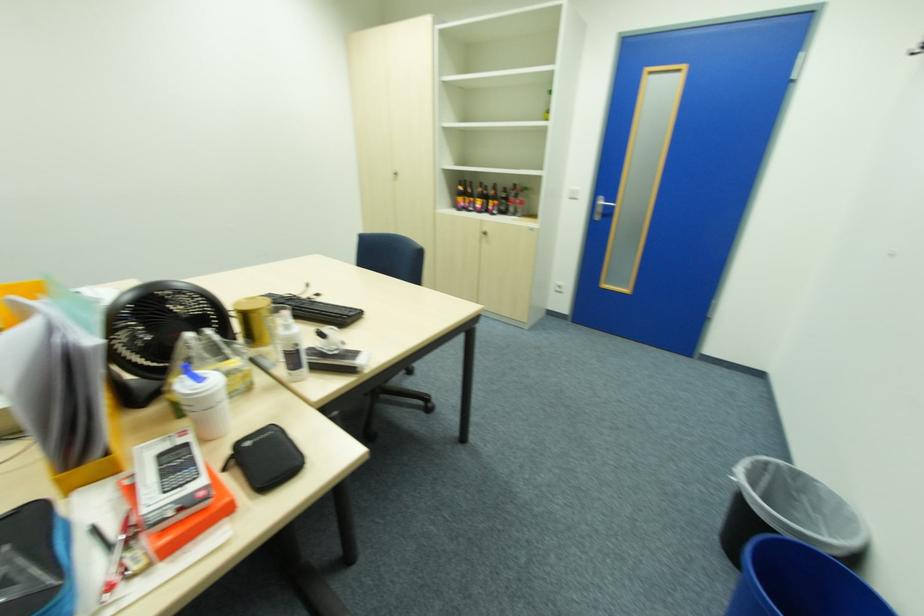
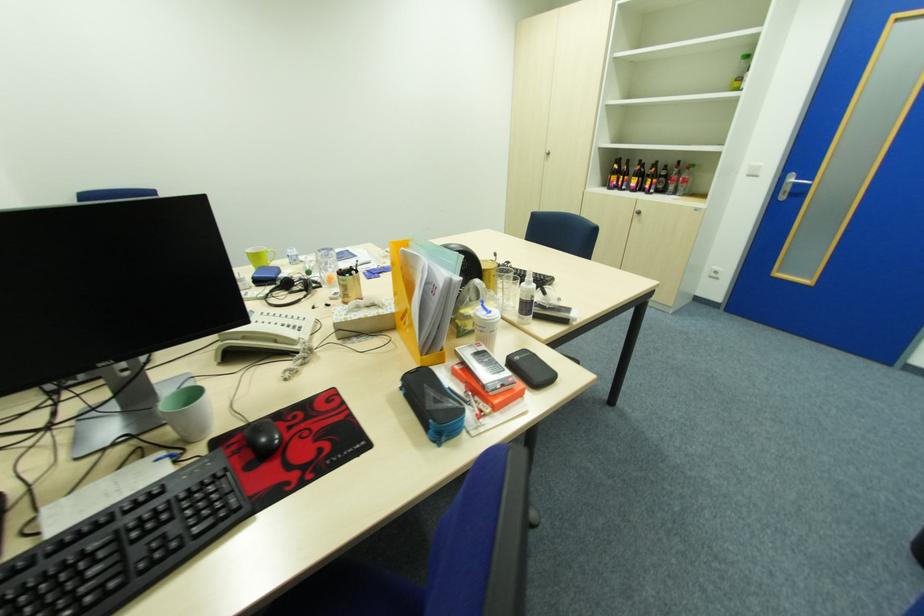
Looking at this image, the images are taken continuously from a first-person perspective. In which direction are you moving?

The cameraman moved toward left, backward.